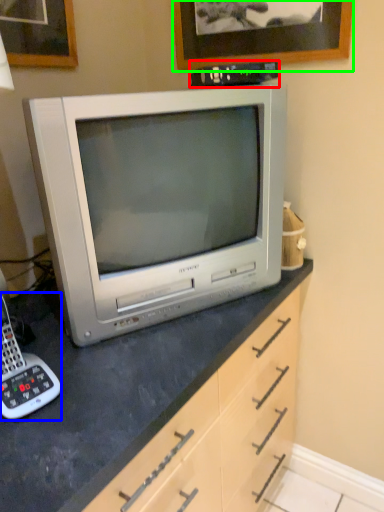
Question: Considering the real-world distances, which object is closest to appliance (highlighted by a red box)? corded phone (highlighted by a blue box) or picture frame (highlighted by a green box).

Choices:
 (A) corded phone
 (B) picture frame

Answer: (B)